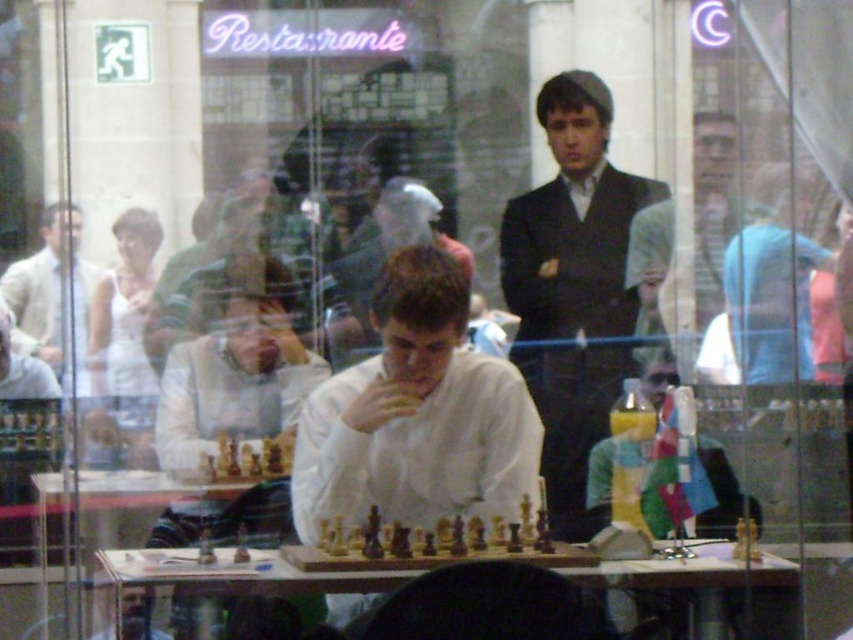
Who is more forward, (418, 518) or (426, 561)?

Point (426, 561) is more forward.

Is white matte shirt at center below wooden chess pieces at center?

No, white matte shirt at center is not below wooden chess pieces at center.

Is point (345, 378) less distant than point (474, 522)?

No, it is not.

Find the location of `white matte shirt at center`. white matte shirt at center is located at coordinates (416, 416).

Between white matte shirt at center and transparent glass chessboard at center, which one appears on the right side from the viewer's perspective?

transparent glass chessboard at center

Can you confirm if white matte shirt at center is taller than transparent glass chessboard at center?

Yes.

This screenshot has width=853, height=640. What do you see at coordinates (416, 416) in the screenshot?
I see `white matte shirt at center` at bounding box center [416, 416].

The height and width of the screenshot is (640, 853). I want to click on white matte shirt at center, so click(416, 416).

In the scene shown: Can you confirm if light brown suit at center is thinner than wooden chess pieces at center?

Yes.

Is light brown suit at center further to the viewer compared to wooden chess pieces at center?

That is True.

At what (x,y) coordinates should I click in order to perform the action: click on light brown suit at center. Please return your answer as a coordinate pair (x, y). Image resolution: width=853 pixels, height=640 pixels. Looking at the image, I should click on (685, 243).